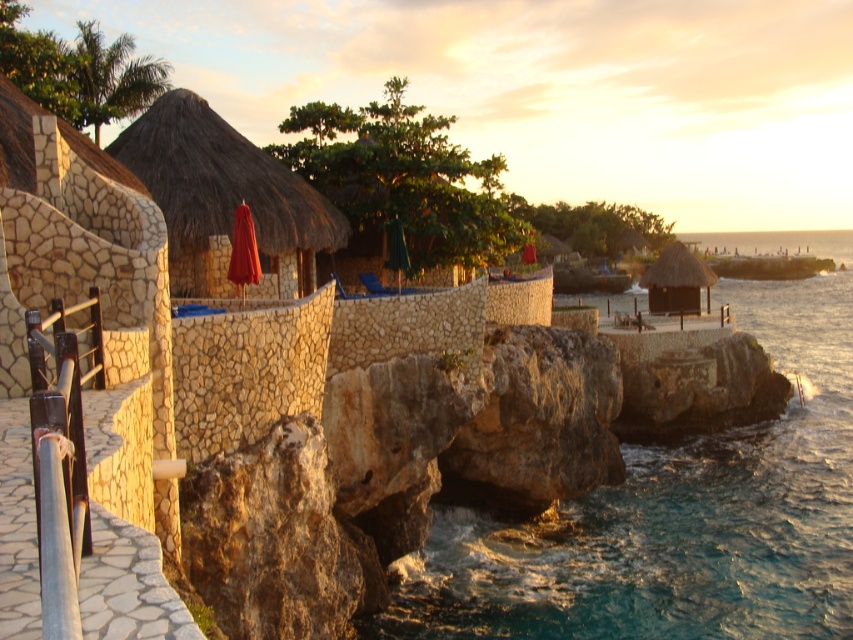
Question: Is teal stone water at center further to camera compared to matte red umbrella at center?

Choices:
 (A) no
 (B) yes

Answer: (B)

Question: Estimate the real-world distances between objects in this image. Which object is farther from the thatched straw hut at center?

Choices:
 (A) green fabric umbrella at center
 (B) teal stone water at center
 (C) matte red umbrella at center

Answer: (C)

Question: Which is farther from the thatched straw hut at left?

Choices:
 (A) teal stone water at center
 (B) matte red umbrella at center
 (C) green fabric umbrella at center
 (D) thatched straw hut at center

Answer: (D)

Question: Which object appears closest to the camera in this image?

Choices:
 (A) green fabric umbrella at center
 (B) thatched straw hut at left

Answer: (B)

Question: Can you confirm if matte red umbrella at center is smaller than green fabric umbrella at center?

Choices:
 (A) yes
 (B) no

Answer: (A)

Question: Does teal stone water at center lie in front of green fabric umbrella at center?

Choices:
 (A) yes
 (B) no

Answer: (A)